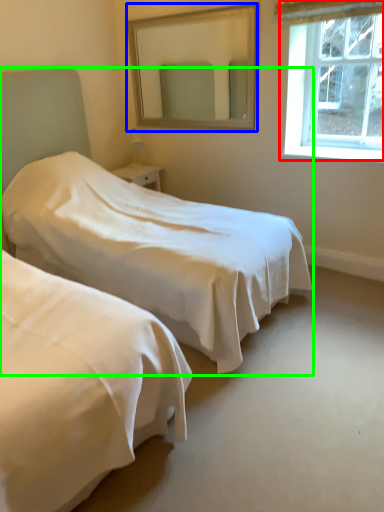
Question: Which is farther away from window (highlighted by a red box)? mirror (highlighted by a blue box) or bed (highlighted by a green box)?

Choices:
 (A) mirror
 (B) bed

Answer: (B)